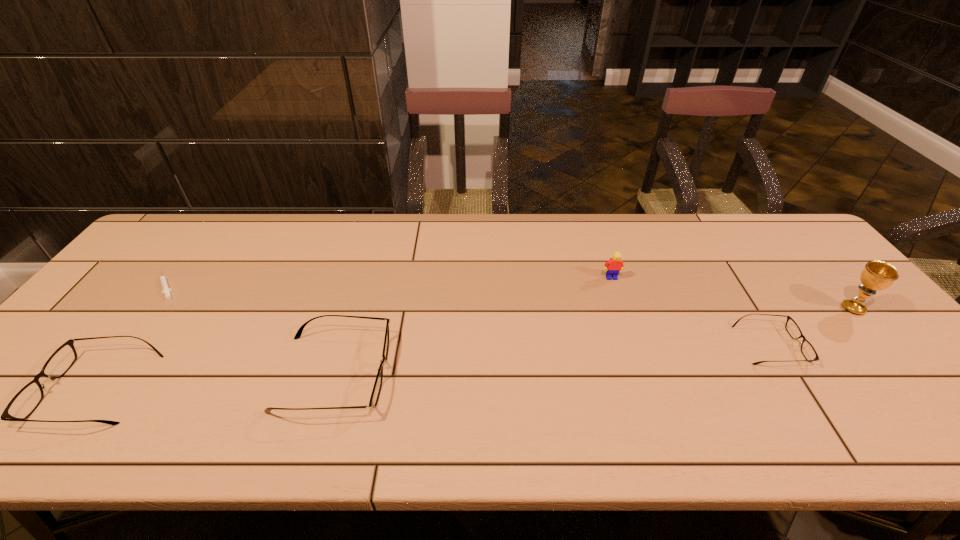
Where is `free space that satisfies the following two spatial constraints: 1. on the front-facing side of the second tallest object; 2. on the left side of the chalice`? The width and height of the screenshot is (960, 540). free space that satisfies the following two spatial constraints: 1. on the front-facing side of the second tallest object; 2. on the left side of the chalice is located at coordinates (621, 308).

Locate an element on the screen. vacant area that satisfies the following two spatial constraints: 1. on the front-facing side of the second tallest object; 2. on the front-facing side of the third shortest object is located at coordinates (648, 388).

Where is `free location that satisfies the following two spatial constraints: 1. on the front side of the chalice; 2. on the left side of the shortest object`? This screenshot has width=960, height=540. free location that satisfies the following two spatial constraints: 1. on the front side of the chalice; 2. on the left side of the shortest object is located at coordinates (150, 308).

This screenshot has height=540, width=960. I want to click on free space that satisfies the following two spatial constraints: 1. on the front-facing side of the second tallest object; 2. on the front-facing side of the second tallest spectacles, so click(x=648, y=388).

I want to click on free space that satisfies the following two spatial constraints: 1. on the front-facing side of the fourth object from left to right; 2. on the front-facing side of the second shortest spectacles, so click(648, 388).

This screenshot has height=540, width=960. I want to click on free space that satisfies the following two spatial constraints: 1. on the front-facing side of the tallest object; 2. on the right side of the fourth object from left to right, so click(x=621, y=308).